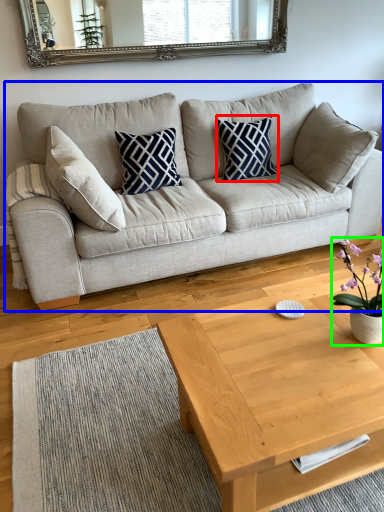
Question: Based on their relative distances, which object is nearer to pillow (highlighted by a red box)? Choose from studio couch (highlighted by a blue box) and houseplant (highlighted by a green box).

Choices:
 (A) studio couch
 (B) houseplant

Answer: (A)